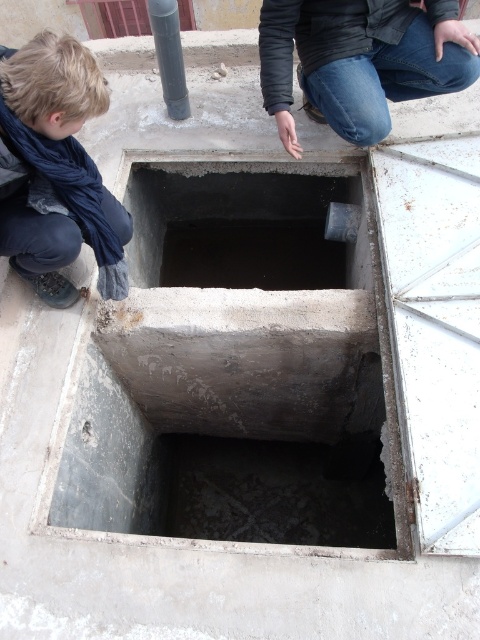
Based on the photo, you are a photographer trying to capture a clear shot of both the blue scarf at lower left and the smooth gray pole at upper left in the same frame. Based on their positions, which object should you adjust your camera angle to focus on first to ensure both are visible?

The blue scarf at lower left is to the left of the smooth gray pole at upper left, so you should focus on the blue scarf at lower left first to ensure both are in frame.

You are standing in front of a utility shaft and notice a blue scarf at lower left. If you want to retrieve it without moving your position, can you reach it?

The blue scarf at lower left is 6.39 feet away from camera. Since 6.39 feet is approximately 76.68 inches, which is beyond typical human arm length, you cannot reach it without moving your position.